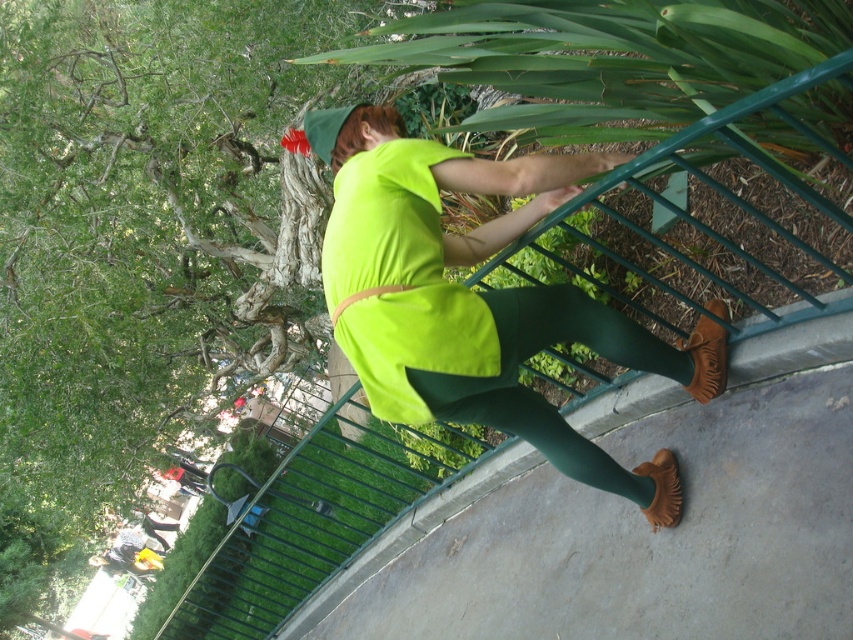
Between neon green fabric at center and green matte leggings at center, which one appears on the left side from the viewer's perspective?

From the viewer's perspective, neon green fabric at center appears more on the left side.

Where is `neon green fabric at center`? The height and width of the screenshot is (640, 853). neon green fabric at center is located at coordinates (477, 300).

Does neon green fabric safety vest at center have a greater width compared to green matte leggings at center?

Incorrect, neon green fabric safety vest at center's width does not surpass green matte leggings at center's.

Describe the element at coordinates (399, 280) in the screenshot. I see `neon green fabric safety vest at center` at that location.

Is point (376, 372) closer to camera compared to point (514, 380)?

Yes.

Locate an element on the screen. neon green fabric safety vest at center is located at coordinates (399, 280).

Is point (397, 257) positioned after point (341, 346)?

No, (397, 257) is closer to viewer.

Which is behind, point (432, 396) or point (349, 241)?

Point (349, 241)

Which is behind, point (409, 368) or point (383, 337)?

The point (383, 337) is more distant.

Locate an element on the screen. neon green fabric at center is located at coordinates (477, 300).